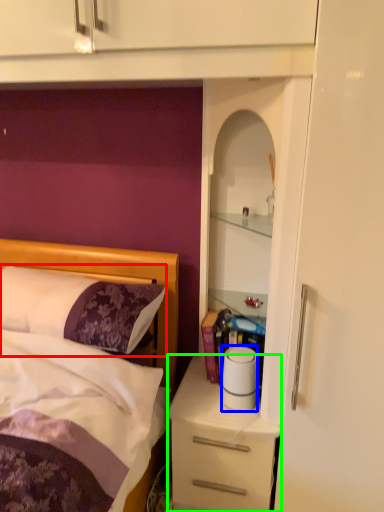
Question: Which object is the closest to the pillow (highlighted by a red box)? Choose among these: toilet paper (highlighted by a blue box) or desk (highlighted by a green box).

Choices:
 (A) toilet paper
 (B) desk

Answer: (A)